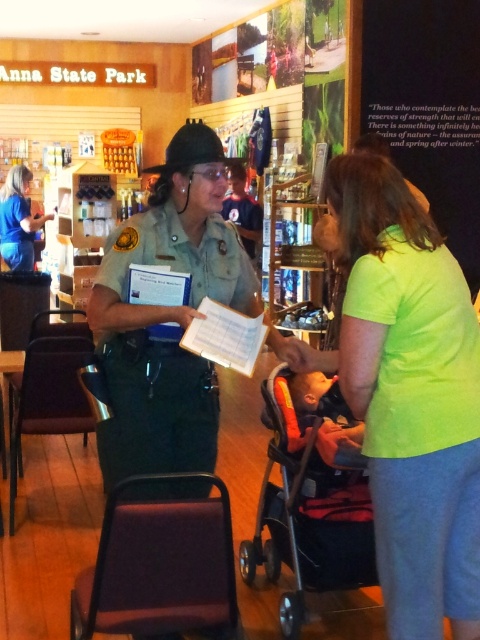
Question: Among these objects, which one is farthest from the camera?

Choices:
 (A) black plastic baby carriage at lower center
 (B) blue shirt at upper left
 (C) matte green uniform at left

Answer: (B)

Question: Which point is farther to the camera?

Choices:
 (A) matte green uniform at left
 (B) green uniform at center

Answer: (A)

Question: Can you confirm if green uniform at center is wider than matte green uniform at left?

Choices:
 (A) yes
 (B) no

Answer: (A)

Question: Is green uniform at center smaller than matte green uniform at left?

Choices:
 (A) yes
 (B) no

Answer: (B)

Question: Which point appears closest to the camera in this image?

Choices:
 (A) (201, 392)
 (B) (17, 260)
 (C) (317, 552)

Answer: (A)

Question: Where is neon green shirt at center located in relation to green uniform at center in the image?

Choices:
 (A) right
 (B) left

Answer: (A)